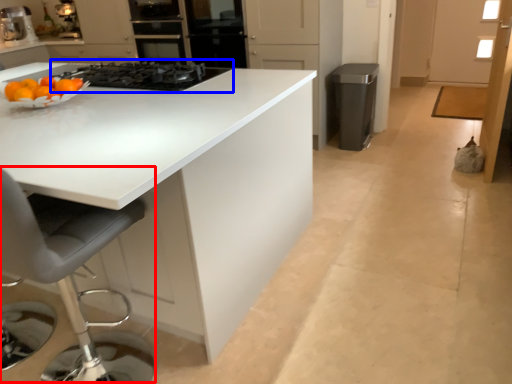
Question: Among these objects, which one is farthest to the camera, swivel chair (highlighted by a red box) or gas stove (highlighted by a blue box)?

Choices:
 (A) swivel chair
 (B) gas stove

Answer: (B)